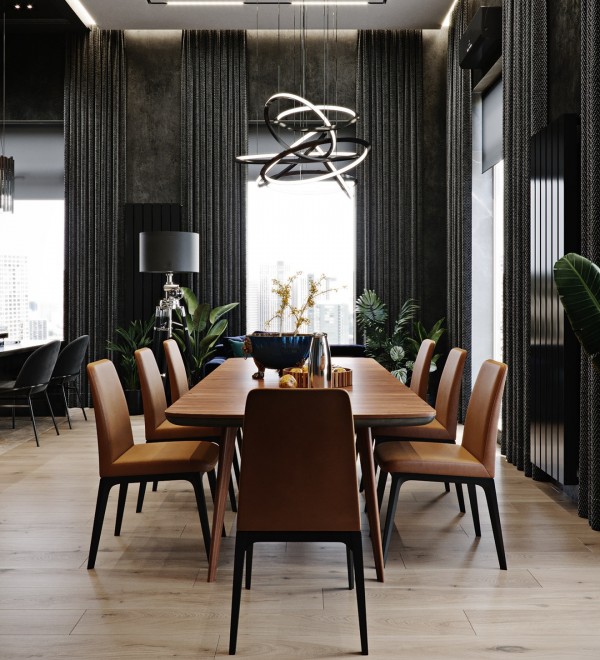
Locate an element on the screen. The width and height of the screenshot is (600, 660). table is located at coordinates (393, 380).